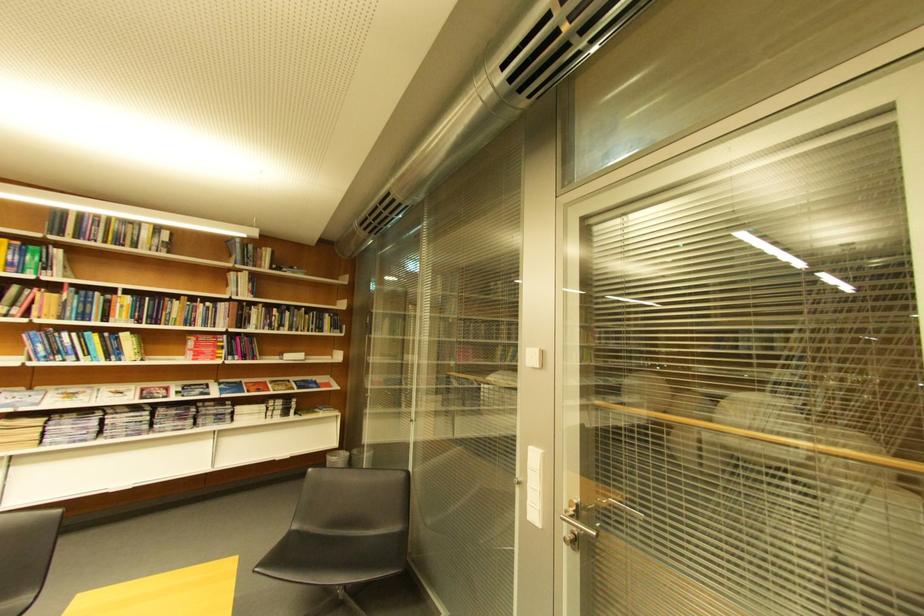
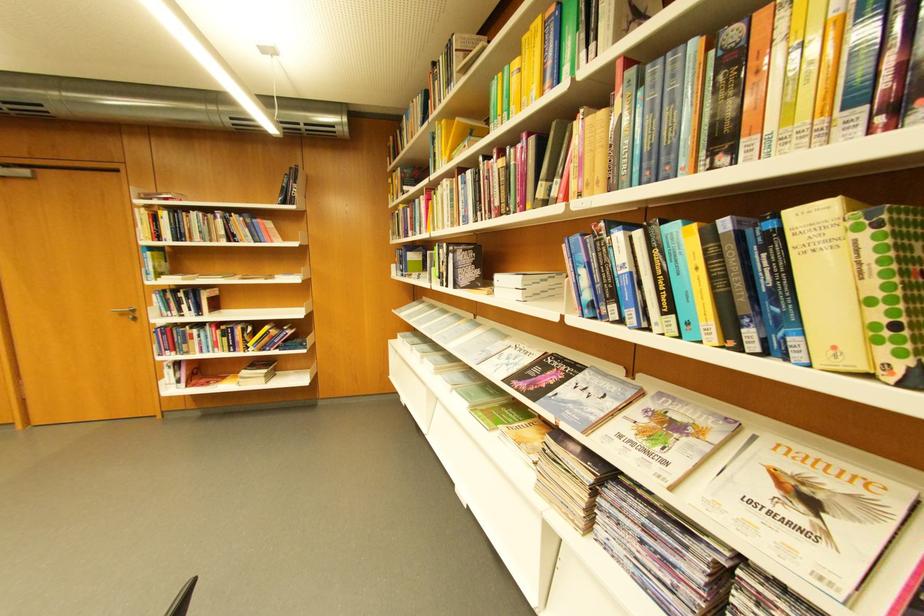
Locate, in the second image, the point that corresponds to point (124, 391) in the first image.

(800, 469)